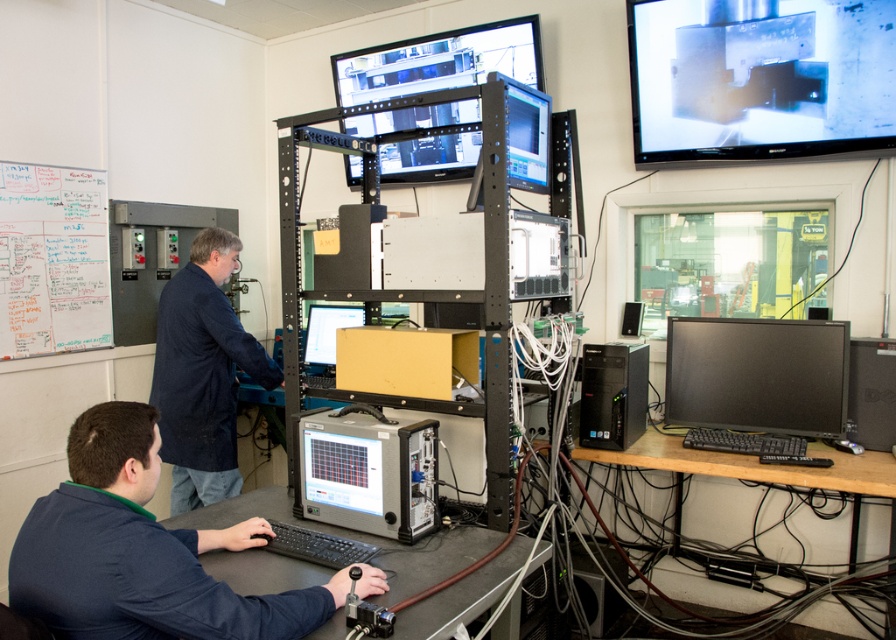
Between dark blue shirt at lower left and matte black monitor at center, which one has less height?

With less height is matte black monitor at center.

Can you confirm if dark blue shirt at lower left is smaller than matte black monitor at center?

No.

Image resolution: width=896 pixels, height=640 pixels. What are the coordinates of `dark blue shirt at lower left` in the screenshot? It's located at (139, 552).

Which is above, metallic silver monitor at upper right or gray metallic computer at center?

metallic silver monitor at upper right is above.

This screenshot has width=896, height=640. What do you see at coordinates (761, 77) in the screenshot?
I see `metallic silver monitor at upper right` at bounding box center [761, 77].

Who is more forward, (788, 76) or (418, 422)?

Point (418, 422) is in front.

This screenshot has height=640, width=896. Find the location of `metallic silver monitor at upper right`. metallic silver monitor at upper right is located at coordinates (761, 77).

Is dark blue fabric at left shorter than matte black monitor at upper center?

No.

Who is higher up, dark blue fabric at left or matte black monitor at upper center?

matte black monitor at upper center is above.

The height and width of the screenshot is (640, 896). What are the coordinates of `dark blue fabric at left` in the screenshot? It's located at (203, 372).

This screenshot has height=640, width=896. I want to click on dark blue fabric at left, so click(203, 372).